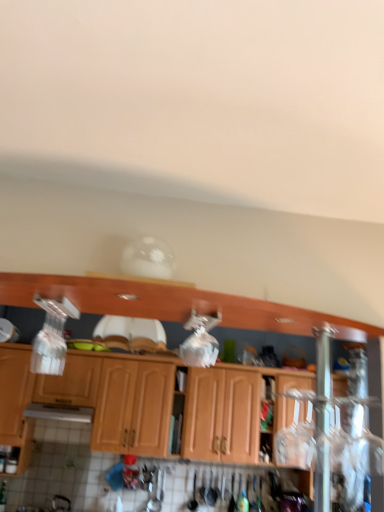
Question: Is wooden cabinet at center, the 2th cabinetry positioned from the front, positioned far away from wooden cabinet at center, the 1th cabinetry positioned from the back?

Choices:
 (A) no
 (B) yes

Answer: (A)

Question: From a real-world perspective, is wooden cabinet at center, the 2th cabinetry positioned from the front, over wooden cabinet at center, the 1th cabinetry positioned from the back?

Choices:
 (A) yes
 (B) no

Answer: (B)

Question: Is wooden cabinet at center, which is counted as the second cabinetry, starting from the back, aimed at wooden cabinet at center, the 3th cabinetry positioned from the front?

Choices:
 (A) yes
 (B) no

Answer: (B)

Question: Is wooden cabinet at center, which is counted as the second cabinetry, starting from the back, at the right side of wooden cabinet at center, the 3th cabinetry positioned from the front?

Choices:
 (A) yes
 (B) no

Answer: (B)

Question: Can you confirm if wooden cabinet at center, the 2th cabinetry positioned from the front, is smaller than wooden cabinet at center, the 3th cabinetry positioned from the front?

Choices:
 (A) no
 (B) yes

Answer: (A)

Question: Which is correct: wooden cabinets at center, placed as the 3th cabinetry when sorted from back to front, is inside wooden cabinet at center, the 3th cabinetry positioned from the front, or outside of it?

Choices:
 (A) outside
 (B) inside

Answer: (A)

Question: From their relative heights in the image, would you say wooden cabinets at center, the first cabinetry in the front-to-back sequence, is taller or shorter than wooden cabinet at center, the 1th cabinetry positioned from the back?

Choices:
 (A) tall
 (B) short

Answer: (B)

Question: Considering the positions of wooden cabinets at center, placed as the 3th cabinetry when sorted from back to front, and wooden cabinet at center, the 3th cabinetry positioned from the front, in the image, is wooden cabinets at center, placed as the 3th cabinetry when sorted from back to front, bigger or smaller than wooden cabinet at center, the 3th cabinetry positioned from the front,?

Choices:
 (A) big
 (B) small

Answer: (B)

Question: From a real-world perspective, is wooden cabinets at center, placed as the 3th cabinetry when sorted from back to front, above or below wooden cabinet at center, the 1th cabinetry positioned from the back?

Choices:
 (A) above
 (B) below

Answer: (A)

Question: Considering the positions of point (152, 408) and point (213, 432), is point (152, 408) closer or farther from the camera than point (213, 432)?

Choices:
 (A) farther
 (B) closer

Answer: (A)

Question: In terms of height, does wooden cabinet at center, the 2th cabinetry positioned from the front, look taller or shorter compared to wooden cabinet at center, the 1th cabinetry positioned from the back?

Choices:
 (A) tall
 (B) short

Answer: (A)

Question: Would you say wooden cabinet at center, which is counted as the second cabinetry, starting from the back, is to the left or to the right of wooden cabinet at center, the 3th cabinetry positioned from the front, in the picture?

Choices:
 (A) right
 (B) left

Answer: (B)

Question: Do you think wooden cabinet at center, the 2th cabinetry positioned from the front, is within wooden cabinet at center, the 1th cabinetry positioned from the back, or outside of it?

Choices:
 (A) inside
 (B) outside

Answer: (B)

Question: In terms of width, does wooden cabinet at center, the 3th cabinetry positioned from the front, look wider or thinner when compared to wooden cabinets at center, the first cabinetry in the front-to-back sequence?

Choices:
 (A) thin
 (B) wide

Answer: (A)

Question: Do you think wooden cabinet at center, the 3th cabinetry positioned from the front, is within wooden cabinets at center, the first cabinetry in the front-to-back sequence, or outside of it?

Choices:
 (A) outside
 (B) inside

Answer: (A)